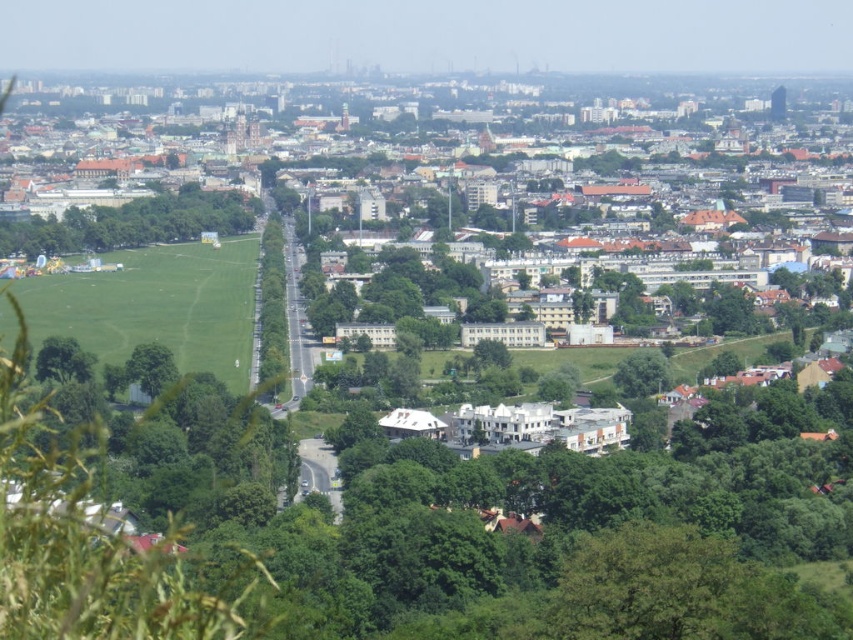
Question: Which object appears closest to the camera in this image?

Choices:
 (A) green leafy tree at left
 (B) green leafy tree at lower right

Answer: (B)

Question: Considering the real-world distances, which object is closest to the green leafy tree at lower right?

Choices:
 (A) green grass field at lower left
 (B) green leafy tree at center
 (C) green leafy tree at left

Answer: (A)

Question: Is green leafy tree at left to the left of green leafy tree at center from the viewer's perspective?

Choices:
 (A) yes
 (B) no

Answer: (A)

Question: Which point appears closest to the camera in this image?

Choices:
 (A) (262, 332)
 (B) (370, 164)

Answer: (A)

Question: Does green grass field at lower left have a greater width compared to green leafy tree at lower right?

Choices:
 (A) no
 (B) yes

Answer: (B)

Question: Is green grass field at lower left to the right of green leafy tree at lower right from the viewer's perspective?

Choices:
 (A) no
 (B) yes

Answer: (A)